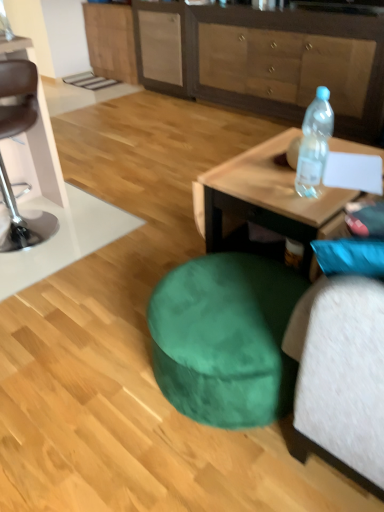
Find the location of a particular element. The image size is (384, 512). vacant space to the left of matte wood cabinet at upper center, acting as the first cabinetry starting from the back is located at coordinates (80, 81).